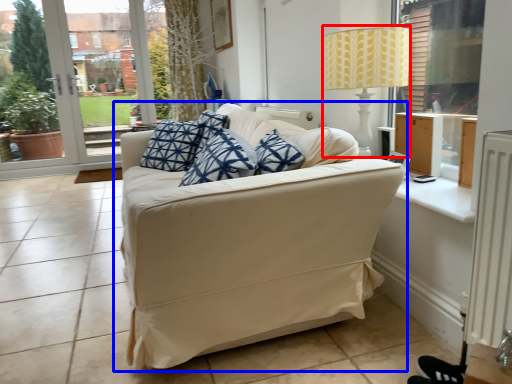
Question: Among these objects, which one is farthest to the camera, table lamp (highlighted by a red box) or studio couch (highlighted by a blue box)?

Choices:
 (A) table lamp
 (B) studio couch

Answer: (A)